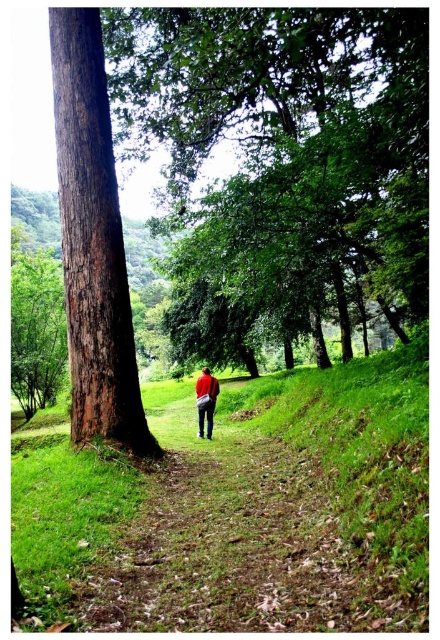
Question: Which object appears closest to the camera in this image?

Choices:
 (A) smooth brown tree trunk at left
 (B) brown rough bark tree at left
 (C) red fabric backpack at center

Answer: (B)

Question: Which point appears farthest from the camera in this image?

Choices:
 (A) (195, 387)
 (B) (40, 372)

Answer: (B)

Question: Is brown rough bark tree at left positioned behind red fabric backpack at center?

Choices:
 (A) no
 (B) yes

Answer: (A)

Question: Which of these objects is positioned farthest from the brown rough bark tree at left?

Choices:
 (A) brown rough tree at center
 (B) red fabric backpack at center
 (C) smooth brown tree trunk at left

Answer: (C)

Question: Can you confirm if smooth brown tree trunk at left is positioned above red fabric backpack at center?

Choices:
 (A) no
 (B) yes

Answer: (B)

Question: Is smooth brown tree trunk at left to the right of red fabric backpack at center from the viewer's perspective?

Choices:
 (A) no
 (B) yes

Answer: (A)